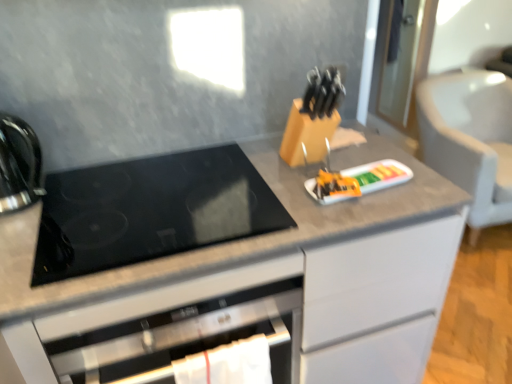
What is the approximate height of gray fabric armchair at right?

gray fabric armchair at right is 29.47 inches in height.

Locate an element on the screen. The image size is (512, 384). wooden cabinet at center is located at coordinates (226, 267).

Describe the element at coordinates (18, 164) in the screenshot. I see `shiny black kettle at left` at that location.

Identify the location of gray fabric armchair at right. (470, 139).

Is gray fabric armchair at right turned away from shiny black kettle at left?

No, gray fabric armchair at right's orientation is not away from shiny black kettle at left.

From a real-world perspective, relative to shiny black kettle at left, is gray fabric armchair at right vertically above or below?

gray fabric armchair at right is below shiny black kettle at left.

Who is bigger, gray fabric armchair at right or shiny black kettle at left?

gray fabric armchair at right is bigger.

I want to click on kitchen appliance that is above the gray fabric armchair at right (from a real-world perspective), so click(18, 164).

Between black glass cooktop at center and gray fabric armchair at right, which one has larger width?

gray fabric armchair at right.

Which is less distant, (260, 233) or (490, 209)?

The point (260, 233) is closer.

Is black glass cooktop at center closer to the viewer compared to gray fabric armchair at right?

Yes, black glass cooktop at center is closer to the viewer.

From the image's perspective, which one is positioned higher, black glass cooktop at center or gray fabric armchair at right?

gray fabric armchair at right.

From a real-world perspective, between gray fabric armchair at right and wooden cabinet at center, who is vertically higher?

wooden cabinet at center, from a real-world perspective.

How different are the orientations of gray fabric armchair at right and wooden cabinet at center in degrees?

Answer: The angle between the facing direction of gray fabric armchair at right and the facing direction of wooden cabinet at center is 5.33 degrees.

Can you confirm if gray fabric armchair at right is thinner than wooden cabinet at center?

No, gray fabric armchair at right is not thinner than wooden cabinet at center.

Can you confirm if gray fabric armchair at right is positioned to the left of wooden cabinet at center?

Incorrect, gray fabric armchair at right is not on the left side of wooden cabinet at center.

Considering the positions of points (400, 312) and (8, 141), is point (400, 312) farther from camera compared to point (8, 141)?

Yes, it is.

Can you confirm if wooden cabinet at center is bigger than shiny black kettle at left?

Indeed, wooden cabinet at center has a larger size compared to shiny black kettle at left.

Is the position of wooden cabinet at center less distant than that of shiny black kettle at left?

No, wooden cabinet at center is behind shiny black kettle at left.

Would you say wooden cabinet at center is to the left or to the right of shiny black kettle at left in the picture?

Clearly, wooden cabinet at center is on the right of shiny black kettle at left in the image.

Is black glass cooktop at center not near wooden cabinet at center?

No, there isn't a large distance between black glass cooktop at center and wooden cabinet at center.

Based on the photo, is black glass cooktop at center situated inside wooden cabinet at center or outside?

black glass cooktop at center is not inside wooden cabinet at center, it's outside.

Considering the sizes of objects black glass cooktop at center and wooden cabinet at center in the image provided, who is thinner, black glass cooktop at center or wooden cabinet at center?

black glass cooktop at center.

In the scene shown: Who is shorter, orange plastic tray at center or gray fabric armchair at right?

orange plastic tray at center.

Would you say gray fabric armchair at right is part of orange plastic tray at center's contents?

No, gray fabric armchair at right is not inside orange plastic tray at center.

Find the location of a particular element. armchair above the orange plastic tray at center (from the image's perspective) is located at coordinates (470, 139).

Is orange plastic tray at center smaller than wooden cabinet at center?

Indeed, orange plastic tray at center has a smaller size compared to wooden cabinet at center.

From a real-world perspective, who is located higher, orange plastic tray at center or wooden cabinet at center?

orange plastic tray at center.

Which object is positioned more to the left, orange plastic tray at center or wooden cabinet at center?

Answer: From the viewer's perspective, wooden cabinet at center appears more on the left side.

Find the location of a particular element. The width and height of the screenshot is (512, 384). armchair above the shiny black kettle at left (from the image's perspective) is located at coordinates (470, 139).

The image size is (512, 384). In order to click on gas stove below the gray fabric armchair at right (from the image's perspective) in this screenshot , I will do `click(151, 211)`.

Considering their positions, is wooden cabinet at center positioned closer to shiny black kettle at left than gray fabric armchair at right?

The object closer to shiny black kettle at left is wooden cabinet at center.

Looking at the image, which one is located closer to shiny black kettle at left, wooden cabinet at center or black glass cooktop at center?

The object closer to shiny black kettle at left is black glass cooktop at center.

Looking at the image, which one is located further to wooden cabinet at center, gray fabric armchair at right or shiny black kettle at left?

gray fabric armchair at right lies further to wooden cabinet at center than the other object.

Estimate the real-world distances between objects in this image. Which object is further from shiny black kettle at left, black glass cooktop at center or gray fabric armchair at right?

gray fabric armchair at right is further to shiny black kettle at left.

Which object lies further to the anchor point black glass cooktop at center, shiny black kettle at left or wooden cabinet at center?

Answer: Among the two, shiny black kettle at left is located further to black glass cooktop at center.

When comparing their distances from wooden cabinet at center, does orange plastic tray at center or shiny black kettle at left seem further?

Based on the image, shiny black kettle at left appears to be further to wooden cabinet at center.

From the image, which object appears to be farther from gray fabric armchair at right, black glass cooktop at center or orange plastic tray at center?

black glass cooktop at center is positioned further to the anchor gray fabric armchair at right.

When comparing their distances from orange plastic tray at center, does black glass cooktop at center or gray fabric armchair at right seem closer?

The object closer to orange plastic tray at center is black glass cooktop at center.

At what (x,y) coordinates should I click in order to perform the action: click on cabinetry between black glass cooktop at center and orange plastic tray at center in the horizontal direction. Please return your answer as a coordinate pair (x, y). The width and height of the screenshot is (512, 384). Looking at the image, I should click on (226, 267).

Identify the location of cabinetry located between shiny black kettle at left and gray fabric armchair at right in the left-right direction. [x=226, y=267].

Where is `cabinetry situated between black glass cooktop at center and gray fabric armchair at right from left to right`? The image size is (512, 384). cabinetry situated between black glass cooktop at center and gray fabric armchair at right from left to right is located at coordinates (226, 267).

Image resolution: width=512 pixels, height=384 pixels. I want to click on gas stove between shiny black kettle at left and orange plastic tray at center in the horizontal direction, so click(151, 211).